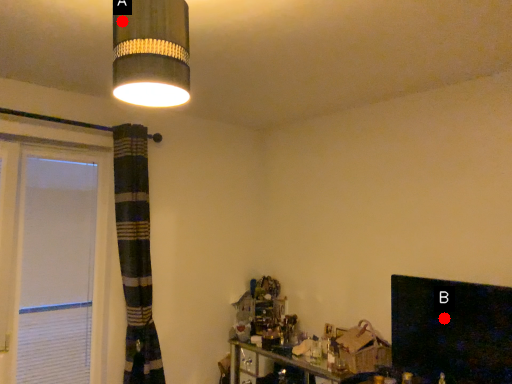
Question: Two points are circled on the image, labeled by A and B beside each circle. Among these points, which one is farthest from the camera?

Choices:
 (A) A is further
 (B) B is further

Answer: (B)